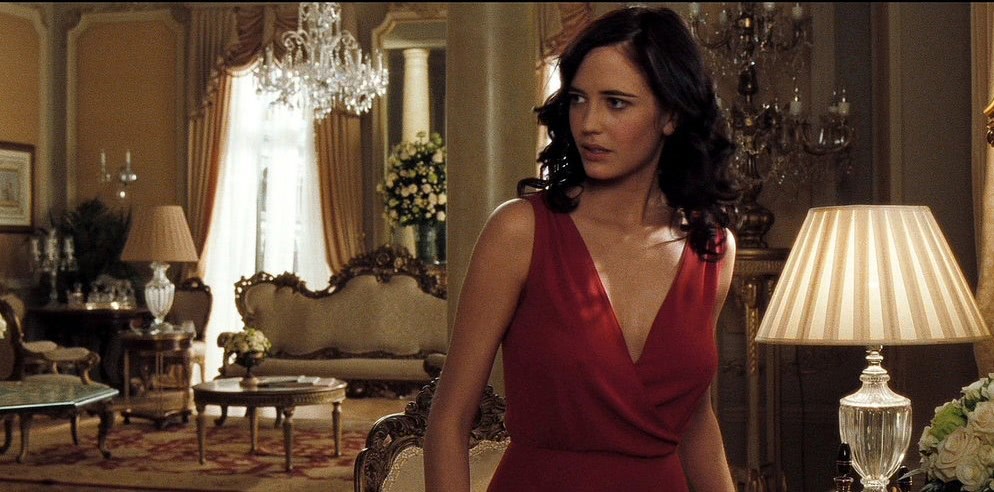
What are the coordinates of `lampshade` in the screenshot? It's located at (870, 297), (159, 237).